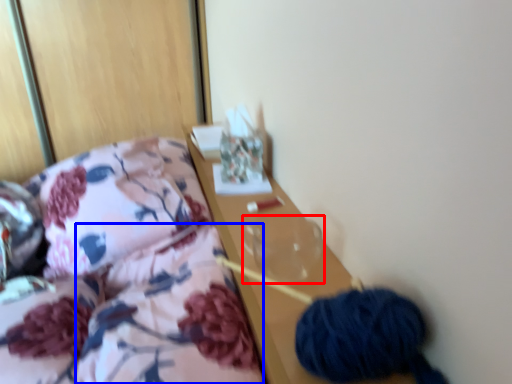
Question: Which object is further to the camera taking this photo, glass vase (highlighted by a red box) or quilt (highlighted by a blue box)?

Choices:
 (A) glass vase
 (B) quilt

Answer: (A)